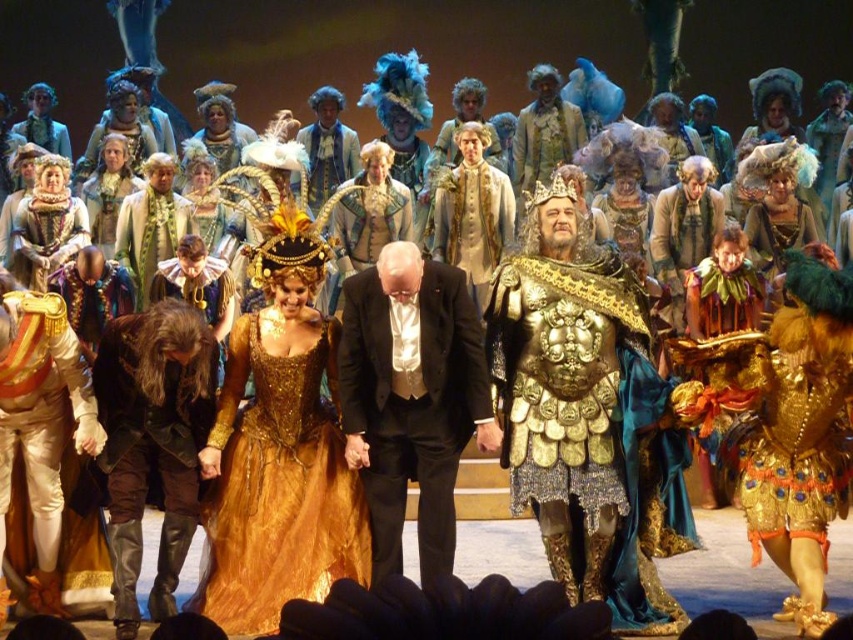
Does black satin suit at center have a greater height compared to leather black boots at lower left?

Yes.

Where is `black satin suit at center`? The width and height of the screenshot is (853, 640). black satin suit at center is located at coordinates (410, 397).

Which is behind, point (343, 348) or point (125, 560)?

The point (343, 348) is more distant.

Identify the location of black satin suit at center. (410, 397).

Can you confirm if gold metallic armor at center is bigger than black satin suit at center?

Correct, gold metallic armor at center is larger in size than black satin suit at center.

Is gold metallic armor at center to the right of black satin suit at center from the viewer's perspective?

Yes, gold metallic armor at center is to the right of black satin suit at center.

Between point (560, 516) and point (432, 362), which one is positioned in front?

Point (560, 516) is in front.

Find the location of a particular element. gold metallic armor at center is located at coordinates (584, 410).

Is gold metallic armor at center taller than gold sequined dress at center?

Yes, gold metallic armor at center is taller than gold sequined dress at center.

Does gold metallic armor at center appear on the right side of gold sequined dress at center?

Yes, gold metallic armor at center is to the right of gold sequined dress at center.

The image size is (853, 640). What do you see at coordinates (584, 410) in the screenshot?
I see `gold metallic armor at center` at bounding box center [584, 410].

I want to click on gold metallic armor at center, so click(x=584, y=410).